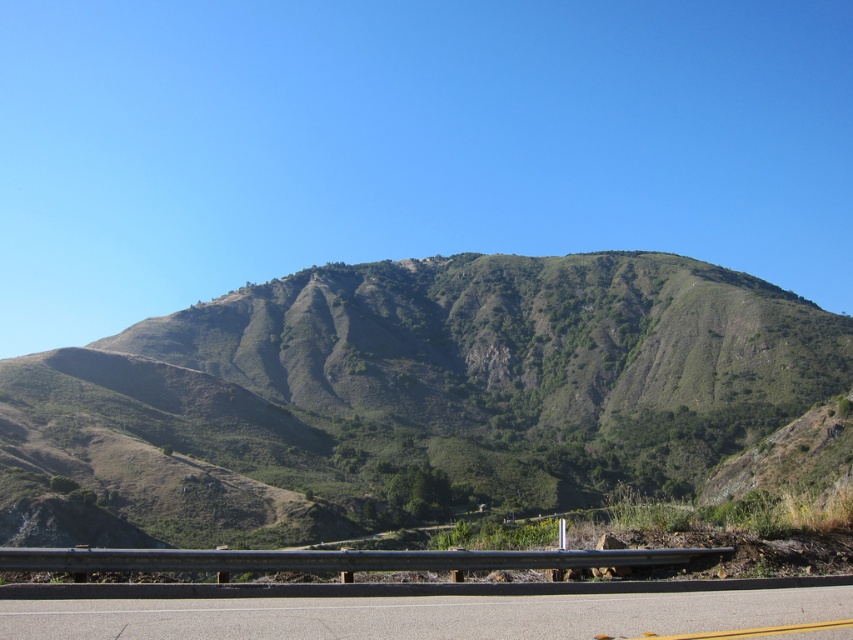
Looking at this image, you are a hiker planning to walk from the asphalt road at center to the green grassy mountain at center. According to the scene, which direction should you head to reach the mountain?

The green grassy mountain at center is to the left of asphalt road at center, so you should head left from the asphalt road at center to reach the mountain.